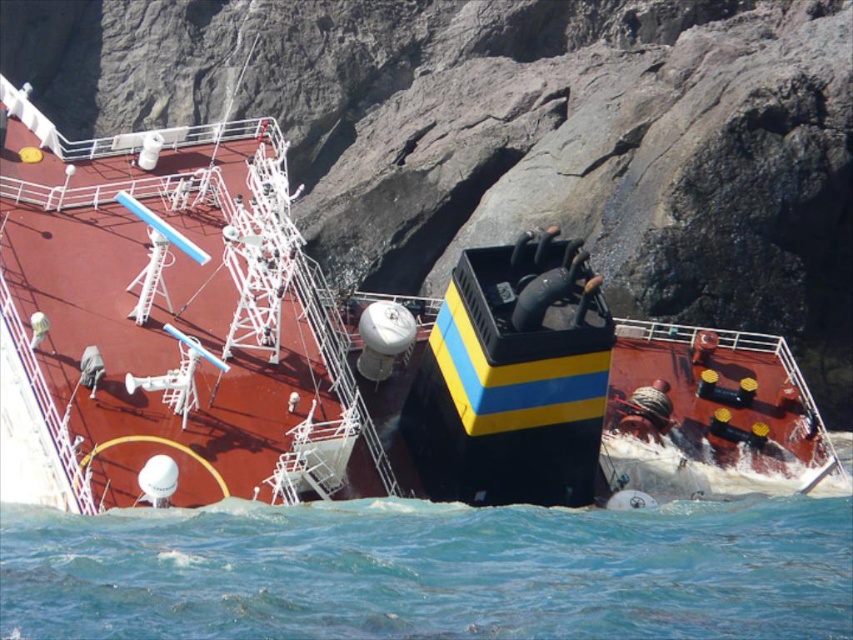
Between shiny black ship at center and blue water at lower center, which one is positioned lower?

blue water at lower center is lower down.

Can you confirm if shiny black ship at center is smaller than blue water at lower center?

No, shiny black ship at center is not smaller than blue water at lower center.

Does point (474, 316) come farther from viewer compared to point (115, 621)?

Yes, point (474, 316) is farther from viewer.

Locate an element on the screen. The height and width of the screenshot is (640, 853). shiny black ship at center is located at coordinates coord(334,349).